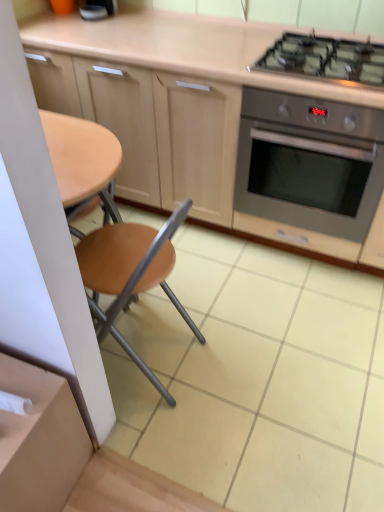
The image size is (384, 512). What do you see at coordinates (325, 59) in the screenshot? I see `black glass gas stove at upper right` at bounding box center [325, 59].

Locate an element on the screen. This screenshot has height=512, width=384. black glass gas stove at upper right is located at coordinates 325,59.

What do you see at coordinates (214, 120) in the screenshot? I see `matte wood cabinetry at upper center` at bounding box center [214, 120].

I want to click on wooden seat at center, so click(x=130, y=274).

At what (x,y) coordinates should I click in order to perform the action: click on stainless steel oven at right. Please return your answer as a coordinate pair (x, y). This screenshot has width=384, height=512. Looking at the image, I should click on (309, 163).

Is the position of black glass gas stove at upper right less distant than that of wooden seat at center?

No, the depth of black glass gas stove at upper right is greater than that of wooden seat at center.

From a real-world perspective, is black glass gas stove at upper right above or below wooden seat at center?

Clearly, from a real-world perspective, black glass gas stove at upper right is above wooden seat at center.

Considering the relative sizes of black glass gas stove at upper right and wooden seat at center in the image provided, is black glass gas stove at upper right taller than wooden seat at center?

No.

Is black glass gas stove at upper right facing away from wooden seat at center?

That's not correct — black glass gas stove at upper right is not looking away from wooden seat at center.

From a real-world perspective, relative to stainless steel oven at right, is black glass gas stove at upper right vertically above or below?

black glass gas stove at upper right is above stainless steel oven at right.

From the image's perspective, between black glass gas stove at upper right and stainless steel oven at right, who is located below?

stainless steel oven at right, from the image's perspective.

Could you tell me if black glass gas stove at upper right is facing stainless steel oven at right?

No, black glass gas stove at upper right is not turned towards stainless steel oven at right.

Between point (371, 54) and point (322, 178), which one is positioned behind?

The point (322, 178) is farther from the camera.

Relative to matte wood cabinetry at upper center, is wooden seat at center in front or behind?

wooden seat at center is in front of matte wood cabinetry at upper center.

Locate an element on the screen. chair located on the left of matte wood cabinetry at upper center is located at coordinates (130, 274).

Between wooden seat at center and matte wood cabinetry at upper center, which one has smaller size?

wooden seat at center.

From their relative heights in the image, would you say wooden seat at center is taller or shorter than matte wood cabinetry at upper center?

Clearly, wooden seat at center is shorter compared to matte wood cabinetry at upper center.

Considering the sizes of objects stainless steel oven at right and matte wood cabinetry at upper center in the image provided, who is taller, stainless steel oven at right or matte wood cabinetry at upper center?

Standing taller between the two is matte wood cabinetry at upper center.

From the picture: In terms of width, does stainless steel oven at right look wider or thinner when compared to matte wood cabinetry at upper center?

stainless steel oven at right is wider than matte wood cabinetry at upper center.

Is stainless steel oven at right to the left or to the right of matte wood cabinetry at upper center in the image?

Clearly, stainless steel oven at right is on the right of matte wood cabinetry at upper center in the image.

What's the angular difference between stainless steel oven at right and matte wood cabinetry at upper center's facing directions?

There is a 0.542-degree angle between the facing directions of stainless steel oven at right and matte wood cabinetry at upper center.

In the scene shown: From the image's perspective, is matte wood cabinetry at upper center above wooden seat at center?

Yes, from the image's perspective, matte wood cabinetry at upper center is above wooden seat at center.

Considering the relative sizes of matte wood cabinetry at upper center and wooden seat at center in the image provided, is matte wood cabinetry at upper center bigger than wooden seat at center?

Yes.

Considering the positions of objects matte wood cabinetry at upper center and wooden seat at center in the image provided, who is more to the right, matte wood cabinetry at upper center or wooden seat at center?

matte wood cabinetry at upper center.

Based on the photo, is wooden seat at center thinner than stainless steel oven at right?

Correct, the width of wooden seat at center is less than that of stainless steel oven at right.

From a real-world perspective, does wooden seat at center stand above stainless steel oven at right?

No, from a real-world perspective, wooden seat at center is not on top of stainless steel oven at right.

How distant is wooden seat at center from stainless steel oven at right?

The distance of wooden seat at center from stainless steel oven at right is 30.82 inches.

From the image's perspective, which one is positioned lower, wooden seat at center or stainless steel oven at right?

wooden seat at center appears lower in the image.

Is black glass gas stove at upper right aimed at matte wood cabinetry at upper center?

Yes, black glass gas stove at upper right is facing matte wood cabinetry at upper center.

Considering the sizes of objects black glass gas stove at upper right and matte wood cabinetry at upper center in the image provided, who is shorter, black glass gas stove at upper right or matte wood cabinetry at upper center?

With less height is black glass gas stove at upper right.

Where is `gas stove on the right of the matte wood cabinetry at upper center`? This screenshot has height=512, width=384. gas stove on the right of the matte wood cabinetry at upper center is located at coordinates (325, 59).

From the image's perspective, is black glass gas stove at upper right located above or below matte wood cabinetry at upper center?

black glass gas stove at upper right is above matte wood cabinetry at upper center.

Identify the location of chair beneath the black glass gas stove at upper right (from a real-world perspective). This screenshot has width=384, height=512. (130, 274).

The image size is (384, 512). Find the location of `kitchen appliance below the black glass gas stove at upper right (from the image's perspective)`. kitchen appliance below the black glass gas stove at upper right (from the image's perspective) is located at coordinates (309, 163).

Considering their positions, is matte wood cabinetry at upper center positioned closer to stainless steel oven at right than black glass gas stove at upper right?

matte wood cabinetry at upper center is positioned closer to the anchor stainless steel oven at right.

Based on their spatial positions, is wooden seat at center or black glass gas stove at upper right closer to matte wood cabinetry at upper center?

black glass gas stove at upper right lies closer to matte wood cabinetry at upper center than the other object.

Considering their positions, is matte wood cabinetry at upper center positioned closer to black glass gas stove at upper right than stainless steel oven at right?

stainless steel oven at right.

Which object lies further to the anchor point stainless steel oven at right, wooden seat at center or matte wood cabinetry at upper center?

wooden seat at center is further to stainless steel oven at right.

Considering their positions, is stainless steel oven at right positioned closer to matte wood cabinetry at upper center than wooden seat at center?

The object closer to matte wood cabinetry at upper center is stainless steel oven at right.

When comparing their distances from matte wood cabinetry at upper center, does black glass gas stove at upper right or wooden seat at center seem closer?

Among the two, black glass gas stove at upper right is located nearer to matte wood cabinetry at upper center.

Looking at the image, which one is located closer to stainless steel oven at right, wooden seat at center or black glass gas stove at upper right?

black glass gas stove at upper right is positioned closer to the anchor stainless steel oven at right.

Which object lies nearer to the anchor point black glass gas stove at upper right, stainless steel oven at right or matte wood cabinetry at upper center?

stainless steel oven at right is closer to black glass gas stove at upper right.

Find the location of a particular element. The height and width of the screenshot is (512, 384). cabinetry situated between wooden seat at center and stainless steel oven at right from left to right is located at coordinates (214, 120).

Locate an element on the screen. The height and width of the screenshot is (512, 384). cabinetry between black glass gas stove at upper right and wooden seat at center vertically is located at coordinates (214, 120).

Image resolution: width=384 pixels, height=512 pixels. In order to click on kitchen appliance between black glass gas stove at upper right and wooden seat at center in the up-down direction in this screenshot , I will do `click(309, 163)`.

The width and height of the screenshot is (384, 512). I want to click on gas stove between matte wood cabinetry at upper center and stainless steel oven at right from left to right, so click(x=325, y=59).